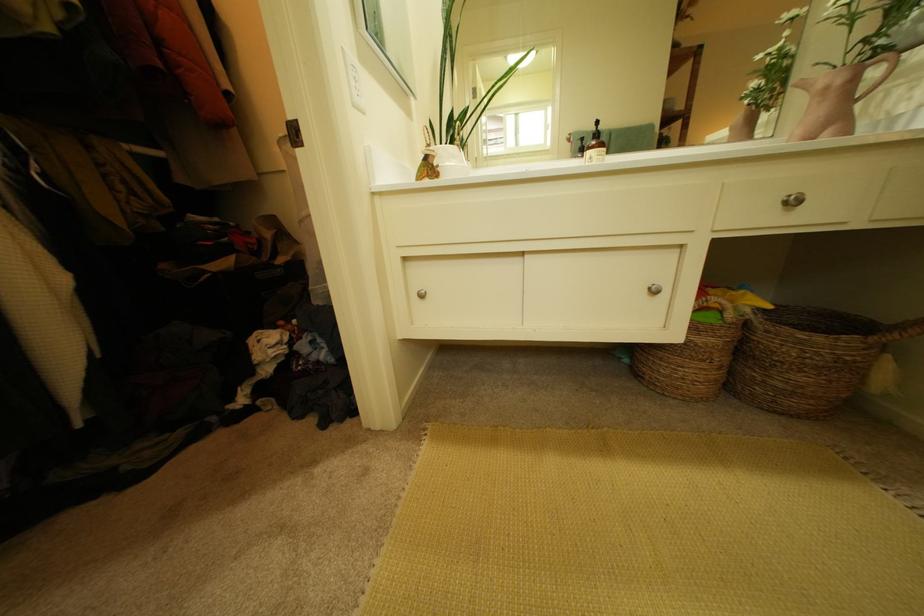
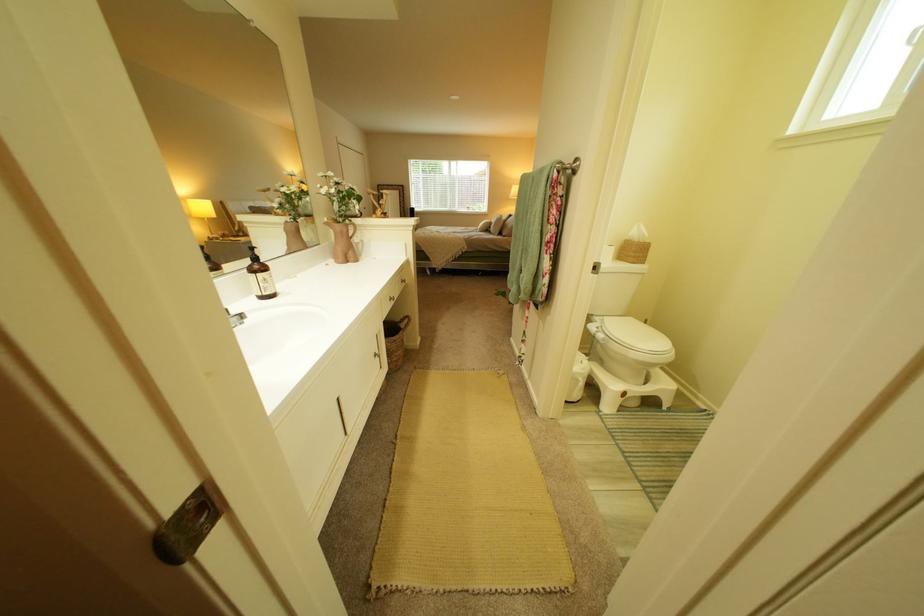
Question: I am providing you with two images of the same scene from different viewpoints. Please identify which objects are invisible in image2.

Choices:
 (A) wicker basket
 (B) silver faucet handle
 (C) white toilet lid
 (D) none of these

Answer: (D)